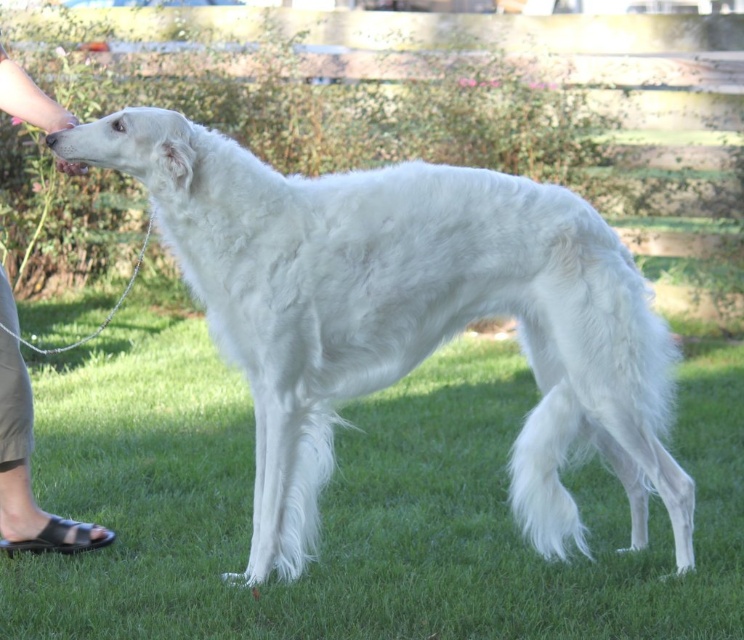
Question: Does white fluffy dog at center appear over tan leather sandals at lower left?

Choices:
 (A) yes
 (B) no

Answer: (A)

Question: Does white fluffy dog at center appear under tan leather sandals at lower left?

Choices:
 (A) no
 (B) yes

Answer: (A)

Question: Which of the following is the closest to the observer?

Choices:
 (A) white fluffy dog at center
 (B) tan leather sandals at lower left

Answer: (A)

Question: Which point appears closest to the camera in this image?

Choices:
 (A) (13, 316)
 (B) (312, 200)

Answer: (B)

Question: Does white fluffy dog at center appear under tan leather sandals at lower left?

Choices:
 (A) no
 (B) yes

Answer: (A)